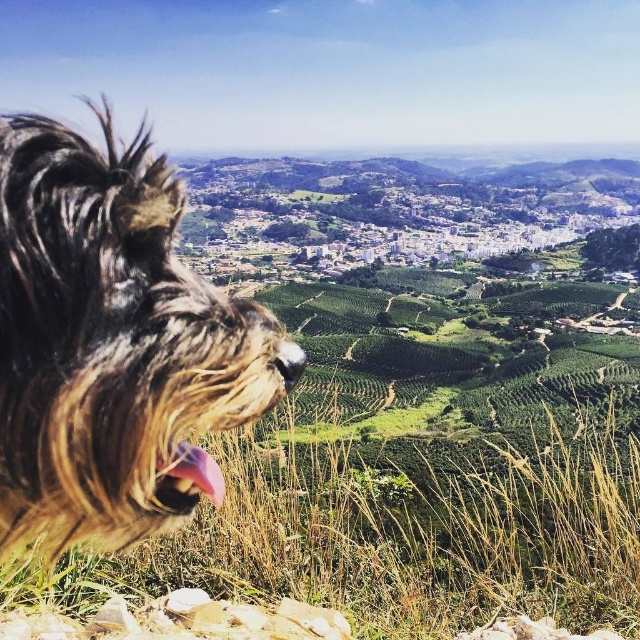
Question: Which point is farther to the camera?

Choices:
 (A) fuzzy brown dog at left
 (B) pink fur at lower left

Answer: (B)

Question: Which object appears closest to the camera in this image?

Choices:
 (A) pink fur at lower left
 (B) fuzzy brown dog at left

Answer: (B)

Question: Is fuzzy brown dog at left bigger than pink fur at lower left?

Choices:
 (A) no
 (B) yes

Answer: (B)

Question: Is the position of fuzzy brown dog at left less distant than that of pink fur at lower left?

Choices:
 (A) no
 (B) yes

Answer: (B)

Question: Can you confirm if fuzzy brown dog at left is positioned below pink fur at lower left?

Choices:
 (A) yes
 (B) no

Answer: (B)